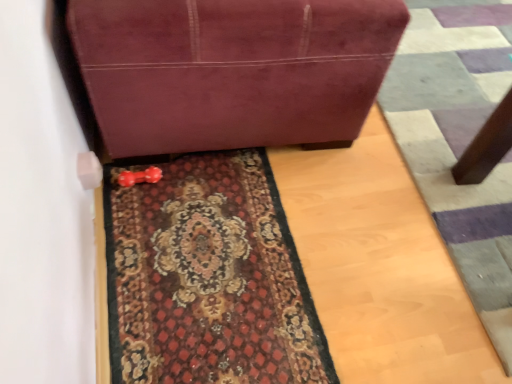
This screenshot has width=512, height=384. What do you see at coordinates (459, 141) in the screenshot? I see `carpeted doormat at lower center` at bounding box center [459, 141].

In order to click on carpeted doormat at lower center in this screenshot , I will do `click(459, 141)`.

From the image's perspective, which is above, carpeted doormat at lower center or suede-like maroon sofa at upper center?

suede-like maroon sofa at upper center.

Considering the sizes of objects carpeted doormat at lower center and suede-like maroon sofa at upper center in the image provided, who is thinner, carpeted doormat at lower center or suede-like maroon sofa at upper center?

Thinner between the two is suede-like maroon sofa at upper center.

Is carpeted doormat at lower center not near suede-like maroon sofa at upper center?

They are positioned close to each other.

From a real-world perspective, is carpeted doormat at lower center positioned over suede-like maroon sofa at upper center based on gravity?

No, from a real-world perspective, carpeted doormat at lower center is not over suede-like maroon sofa at upper center

From a real-world perspective, is suede-like maroon sofa at upper center below carpeted mat at center?

Actually, suede-like maroon sofa at upper center is physically above carpeted mat at center in the real world.

How distant is suede-like maroon sofa at upper center from carpeted mat at center?

They are 16.52 inches apart.

In the scene shown: Can you see suede-like maroon sofa at upper center touching carpeted mat at center?

No, suede-like maroon sofa at upper center is not in contact with carpeted mat at center.

Considering the relative sizes of carpeted doormat at lower center and carpeted mat at center in the image provided, is carpeted doormat at lower center smaller than carpeted mat at center?

Incorrect, carpeted doormat at lower center is not smaller in size than carpeted mat at center.

Are carpeted doormat at lower center and carpeted mat at center making contact?

No, carpeted doormat at lower center is not next to carpeted mat at center.

Is carpeted mat at center at the back of carpeted doormat at lower center?

carpeted doormat at lower center is not turned away from carpeted mat at center.

The height and width of the screenshot is (384, 512). What are the coordinates of `mat that is on the left side of carpeted doormat at lower center` in the screenshot? It's located at (207, 277).

From a real-world perspective, is suede-like maroon sofa at upper center above or below carpeted doormat at lower center?

From a real-world perspective, suede-like maroon sofa at upper center is physically above carpeted doormat at lower center.

Is suede-like maroon sofa at upper center in contact with carpeted doormat at lower center?

There is a gap between suede-like maroon sofa at upper center and carpeted doormat at lower center.

Is point (118, 90) closer to viewer compared to point (394, 115)?

That is True.

From the picture: Is suede-like maroon sofa at upper center in front of or behind carpeted doormat at lower center in the image?

suede-like maroon sofa at upper center is positioned closer to the viewer than carpeted doormat at lower center.

Which object is thinner, carpeted mat at center or carpeted doormat at lower center?

With smaller width is carpeted mat at center.

Which of these two, carpeted mat at center or carpeted doormat at lower center, is bigger?

With larger size is carpeted doormat at lower center.

From the image's perspective, which object appears higher, carpeted mat at center or carpeted doormat at lower center?

carpeted doormat at lower center.

Which object is closer to the camera, carpeted mat at center or suede-like maroon sofa at upper center?

suede-like maroon sofa at upper center is more forward.

Could you tell me if carpeted mat at center is facing suede-like maroon sofa at upper center?

No, carpeted mat at center is not oriented towards suede-like maroon sofa at upper center.

You are a GUI agent. You are given a task and a screenshot of the screen. Output one action in this format:
    pyautogui.click(x=<x>, y=<y>)
    Task: Click on the mat behind the suede-like maroon sofa at upper center
    The image size is (512, 384).
    Given the screenshot: What is the action you would take?
    pyautogui.click(x=207, y=277)

From the image's perspective, does carpeted mat at center appear higher than suede-like maroon sofa at upper center?

No.

This screenshot has width=512, height=384. I want to click on furniture above the carpeted doormat at lower center (from the image's perspective), so click(x=232, y=71).

Where is `furniture that is in front of the carpeted mat at center`? The width and height of the screenshot is (512, 384). furniture that is in front of the carpeted mat at center is located at coordinates 232,71.

Looking at the image, which one is located further to carpeted doormat at lower center, carpeted mat at center or suede-like maroon sofa at upper center?

carpeted mat at center is positioned further to the anchor carpeted doormat at lower center.

When comparing their distances from carpeted doormat at lower center, does suede-like maroon sofa at upper center or carpeted mat at center seem closer?

suede-like maroon sofa at upper center.

Which object lies nearer to the anchor point carpeted mat at center, suede-like maroon sofa at upper center or carpeted doormat at lower center?

Based on the image, suede-like maroon sofa at upper center appears to be nearer to carpeted mat at center.

Looking at this image, estimate the real-world distances between objects in this image. Which object is closer to carpeted mat at center, carpeted doormat at lower center or suede-like maroon sofa at upper center?

suede-like maroon sofa at upper center lies closer to carpeted mat at center than the other object.

Estimate the real-world distances between objects in this image. Which object is closer to suede-like maroon sofa at upper center, carpeted doormat at lower center or carpeted mat at center?

Based on the image, carpeted mat at center appears to be nearer to suede-like maroon sofa at upper center.

Considering their positions, is carpeted mat at center positioned closer to suede-like maroon sofa at upper center than carpeted doormat at lower center?

carpeted mat at center lies closer to suede-like maroon sofa at upper center than the other object.

Identify the location of furniture between carpeted mat at center and carpeted doormat at lower center from left to right. (232, 71).